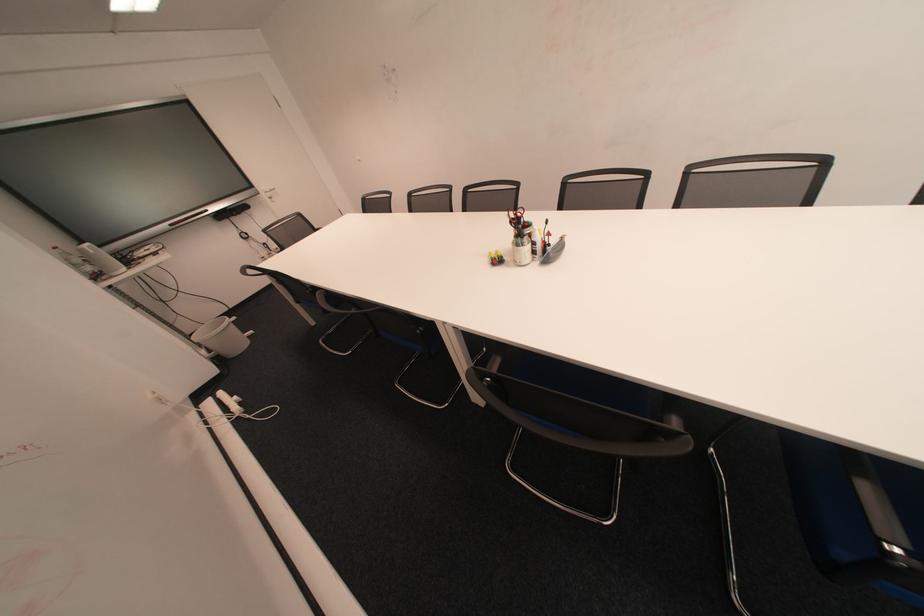
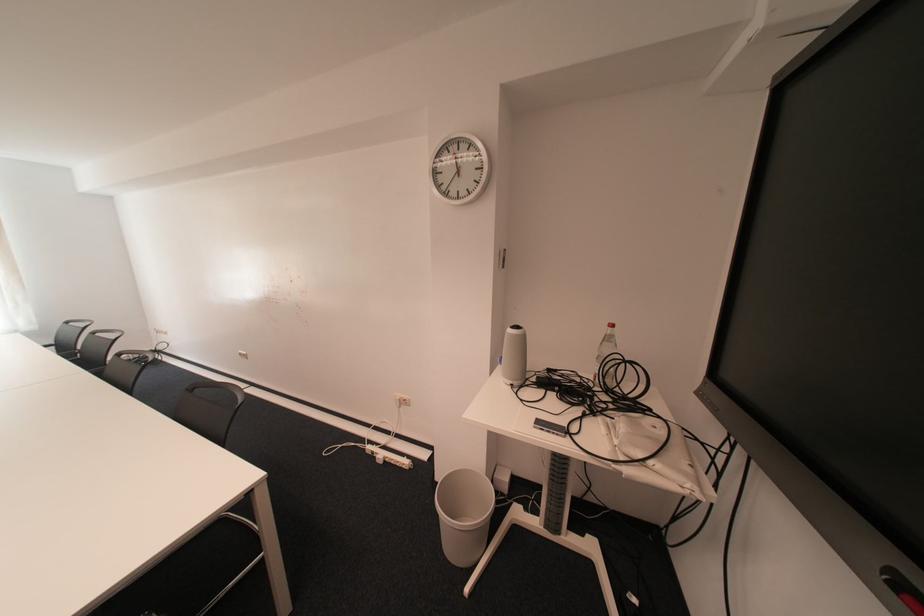
Question: I am providing you with two images of the same scene from different viewpoints. Which of the following objects are not visible in image2?

Choices:
 (A) plastic water bottle
 (B) small electronic device
 (C) chair sitting surface
 (D) none of these

Answer: (D)